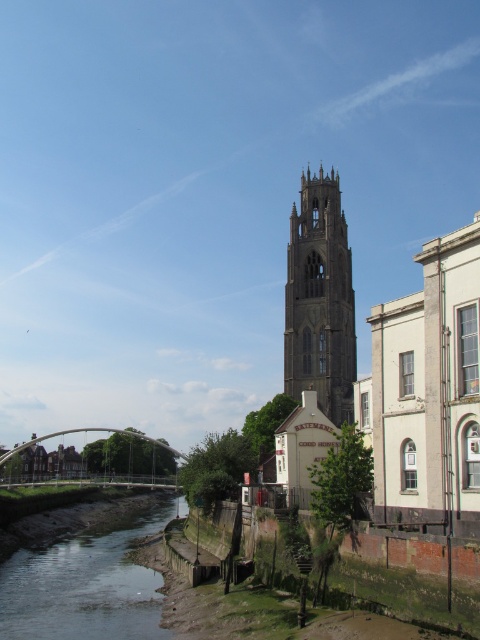
Is point (24, 625) more distant than point (79, 428)?

No.

Does clear water at lower left have a greater width compared to white metallic bridge at lower center?

No, clear water at lower left is not wider than white metallic bridge at lower center.

This screenshot has width=480, height=640. Identify the location of clear water at lower left. (86, 586).

At what (x,y) coordinates should I click in order to perform the action: click on clear water at lower left. Please return your answer as a coordinate pair (x, y). The width and height of the screenshot is (480, 640). Looking at the image, I should click on (86, 586).

Based on the photo, who is more distant from viewer, (452,416) or (121,556)?

Positioned behind is point (121,556).

Between white smooth building at center and clear water at lower left, which one appears on the left side from the viewer's perspective?

clear water at lower left is more to the left.

Does point (383, 480) lie in front of point (163, 525)?

Yes, it is.

This screenshot has width=480, height=640. Find the location of `white smooth building at center`. white smooth building at center is located at coordinates (430, 392).

Can you confirm if white smooth building at center is shorter than stone gothic tower at center?

Yes.

Does white smooth building at center have a larger size compared to stone gothic tower at center?

No.

The image size is (480, 640). Describe the element at coordinates (430, 392) in the screenshot. I see `white smooth building at center` at that location.

Locate an element on the screen. This screenshot has height=640, width=480. white smooth building at center is located at coordinates (430, 392).